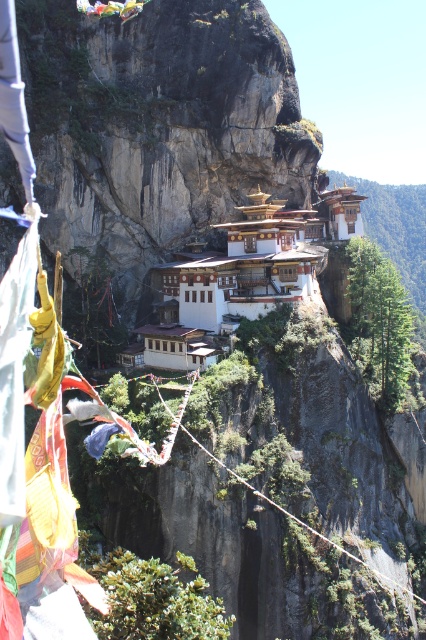
Question: Among these points, which one is farthest from the camera?

Choices:
 (A) (201, 332)
 (B) (402, 589)

Answer: (B)

Question: Is white painted wood monastery at center to the left of rope bridge at center from the viewer's perspective?

Choices:
 (A) no
 (B) yes

Answer: (B)

Question: From the image, what is the correct spatial relationship of white painted wood monastery at center in relation to rope bridge at center?

Choices:
 (A) right
 (B) left

Answer: (B)

Question: Does white painted wood monastery at center have a larger size compared to rope bridge at center?

Choices:
 (A) no
 (B) yes

Answer: (B)